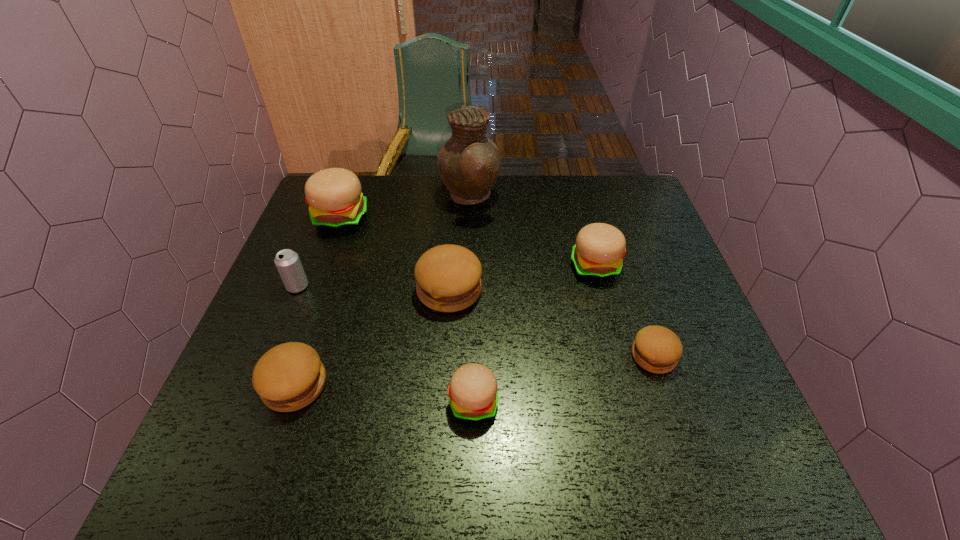
Where is `the nearest beige hamburger`? the nearest beige hamburger is located at coordinates (473, 393).

Locate an element on the screen. the smallest beige hamburger is located at coordinates (473, 393).

Locate an element on the screen. This screenshot has width=960, height=540. the shortest object is located at coordinates click(x=657, y=349).

Locate an element on the screen. Image resolution: width=960 pixels, height=540 pixels. the rightmost brown hamburger is located at coordinates (657, 349).

At what (x,y) coordinates should I click in order to perform the action: click on free space located at the spout of the brown pitcher. Please return your answer as a coordinate pair (x, y). Image resolution: width=960 pixels, height=540 pixels. Looking at the image, I should click on (541, 198).

Find the location of `free space located 0.150m on the front of the leftmost beige hamburger`. free space located 0.150m on the front of the leftmost beige hamburger is located at coordinates (321, 273).

Where is `vacant space located on the right of the rightmost beige hamburger`? Image resolution: width=960 pixels, height=540 pixels. vacant space located on the right of the rightmost beige hamburger is located at coordinates (659, 266).

Identify the location of vacant position located 0.130m on the left of the farthest brown hamburger. This screenshot has width=960, height=540. (364, 290).

The image size is (960, 540). I want to click on free space located 0.320m on the back of the white beer can, so [330, 205].

Where is `vacant space located 0.390m on the right of the second smallest brown hamburger`? Image resolution: width=960 pixels, height=540 pixels. vacant space located 0.390m on the right of the second smallest brown hamburger is located at coordinates (516, 386).